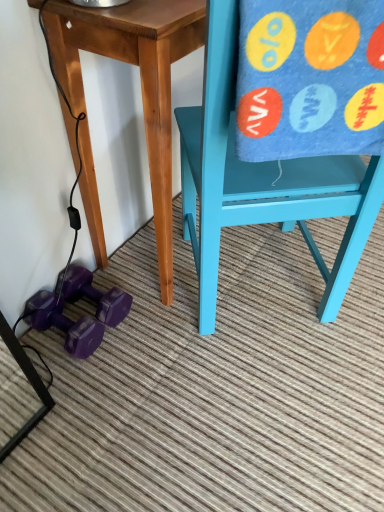
The image size is (384, 512). I want to click on free location in front of wooden table at center, so click(x=165, y=361).